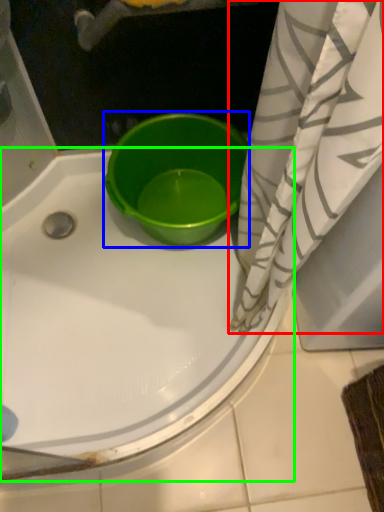
Question: Based on their relative distances, which object is farther from curtain (highlighted by a red box)? Choose from basin (highlighted by a blue box) and bathtub (highlighted by a green box).

Choices:
 (A) basin
 (B) bathtub

Answer: (B)